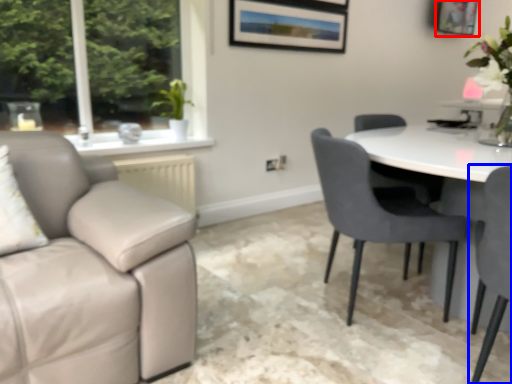
Question: Which object is closer to the camera taking this photo, picture frame (highlighted by a red box) or chair (highlighted by a blue box)?

Choices:
 (A) picture frame
 (B) chair

Answer: (B)